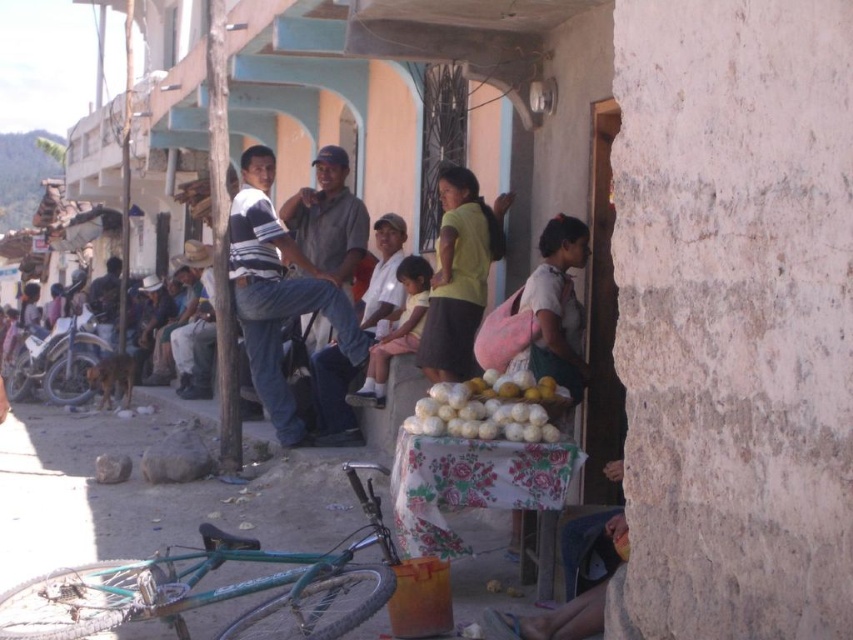
You are a photographer standing at the edge of the street scene. You want to take a photo of both the denim jeans at center and the white matte produce at center. Which object should you focus on first to ensure both are in clear focus?

You should focus on the denim jeans at center first because it is closer to you than the white matte produce at center, ensuring both will be in focus when focused on the closer object.

You are a delivery person who needs to place a package on the ground. You see the denim jeans at center and the white matte produce at center. Which object should you choose to place the package on top of to ensure it stays stable?

The denim jeans at center is bigger than the white matte produce at center, so placing the package on the denim jeans at center would provide a more stable surface due to its larger size.

Consider the image. You are standing at the origin point of the image. Which object, the green bicycle lying on its side or the denim jeans at center, is closer to you?

The denim jeans at center is located at point (292,275), which is closer to the origin compared to the green bicycle lying on its side. Therefore, the denim jeans at center is closer to you.